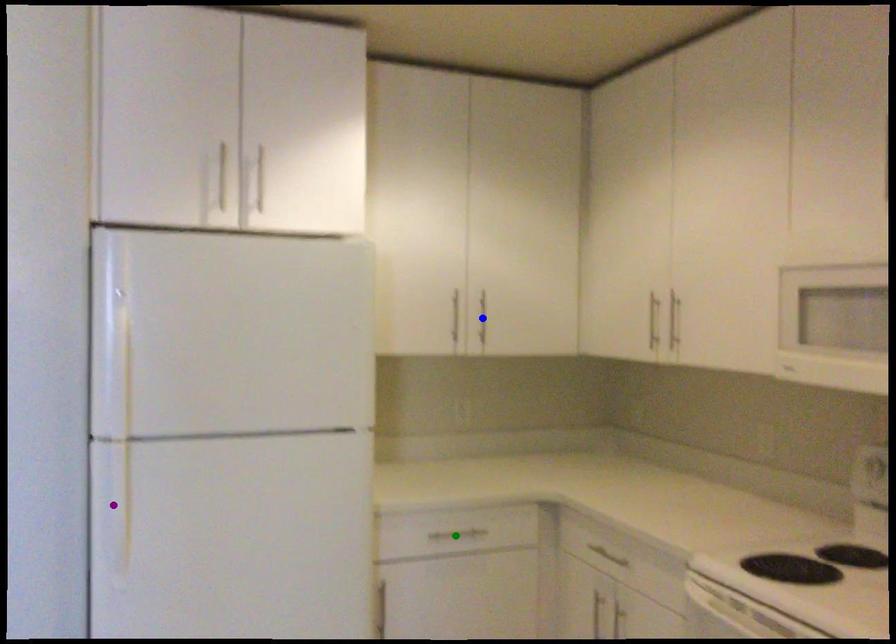
Order these from nearest to farthest:
blue point
purple point
green point

blue point < green point < purple point